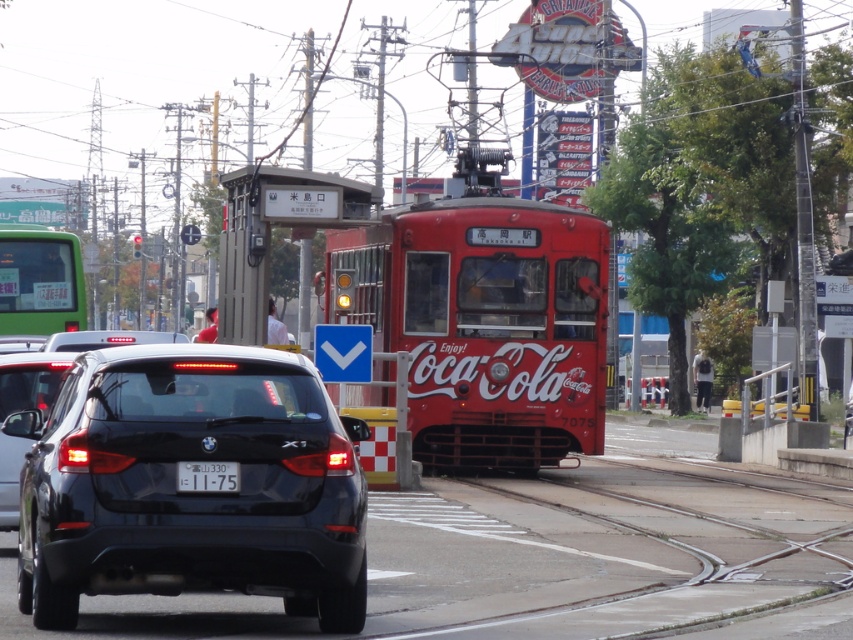
Based on the photo, you are a delivery driver who needs to park your vehicle in this area. There is a point marked at coordinates (x=190, y=492). What is the vehicle located at this point?

The point at coordinates (x=190, y=492) indicates the black matte bmw x1 at center.

You are a delivery person trying to park your van next to the black glossy car at lower left and the white plastic license plate at center. Which object is wider so you can decide where to park your van?

The black glossy car at lower left is wider than the white plastic license plate at center, so you should park your van next to the white plastic license plate at center to have enough space.